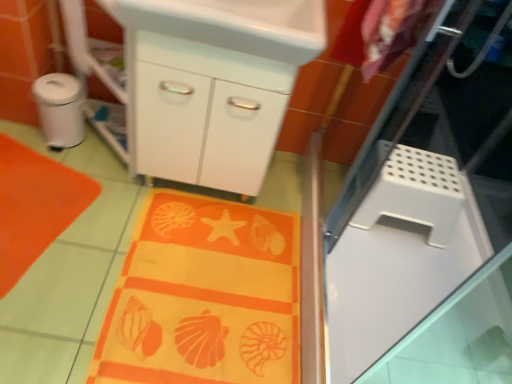
Question: Could you tell me if orange fabric beach towel at lower left is facing orange fabric at lower center?

Choices:
 (A) no
 (B) yes

Answer: (B)

Question: Would you say orange fabric beach towel at lower left is a long distance from orange fabric at lower center?

Choices:
 (A) no
 (B) yes

Answer: (A)

Question: Does orange fabric beach towel at lower left have a lesser width compared to orange fabric at lower center?

Choices:
 (A) no
 (B) yes

Answer: (B)

Question: Would you say orange fabric beach towel at lower left contains orange fabric at lower center?

Choices:
 (A) yes
 (B) no

Answer: (B)

Question: From a real-world perspective, is orange fabric beach towel at lower left on top of orange fabric at lower center?

Choices:
 (A) no
 (B) yes

Answer: (B)

Question: Can you confirm if orange fabric beach towel at lower left is taller than orange fabric at lower center?

Choices:
 (A) yes
 (B) no

Answer: (A)

Question: Can you confirm if white plastic step stool at right, which is counted as the first appliance, starting from the right, is wider than white glossy cabinet at center?

Choices:
 (A) no
 (B) yes

Answer: (A)

Question: Is white plastic step stool at right, the 1th appliance from the bottom, at the right side of white glossy cabinet at center?

Choices:
 (A) no
 (B) yes

Answer: (B)

Question: Is white plastic step stool at right, placed as the second appliance when sorted from top to bottom, next to white glossy cabinet at center?

Choices:
 (A) yes
 (B) no

Answer: (B)

Question: Considering the relative positions of white plastic step stool at right, which ranks as the second appliance in left-to-right order, and white glossy cabinet at center in the image provided, is white plastic step stool at right, which ranks as the second appliance in left-to-right order, in front of white glossy cabinet at center?

Choices:
 (A) no
 (B) yes

Answer: (A)

Question: From the image's perspective, does white plastic step stool at right, the 1th appliance from the bottom, appear higher than white glossy cabinet at center?

Choices:
 (A) yes
 (B) no

Answer: (B)

Question: Does white plastic step stool at right, the 1th appliance from the bottom, have a smaller size compared to white glossy cabinet at center?

Choices:
 (A) no
 (B) yes

Answer: (B)

Question: Would you say white perforated screen door at right is part of orange fabric beach towel at lower left's contents?

Choices:
 (A) no
 (B) yes

Answer: (A)